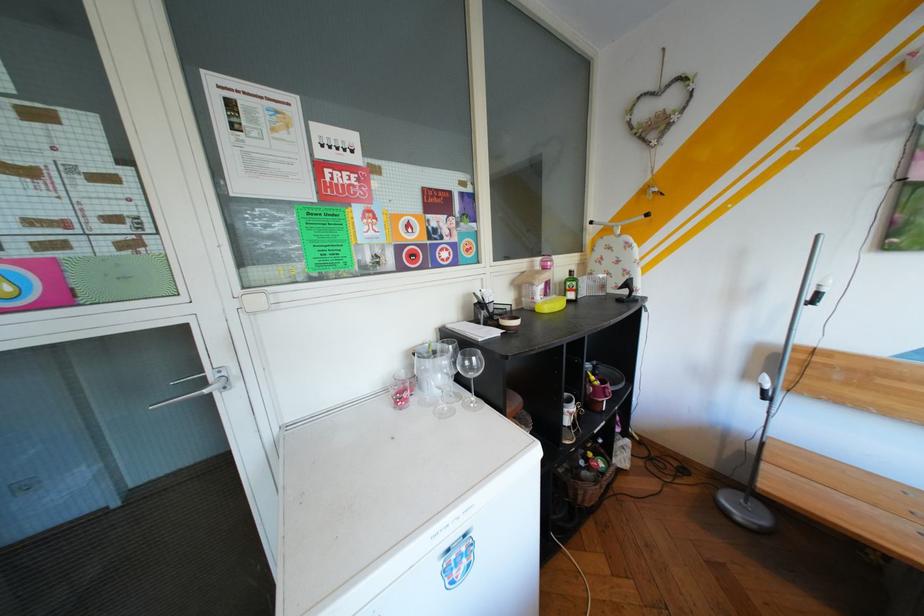
The location [400,389] corresponds to which object?

This point indicates the red patterned glass.